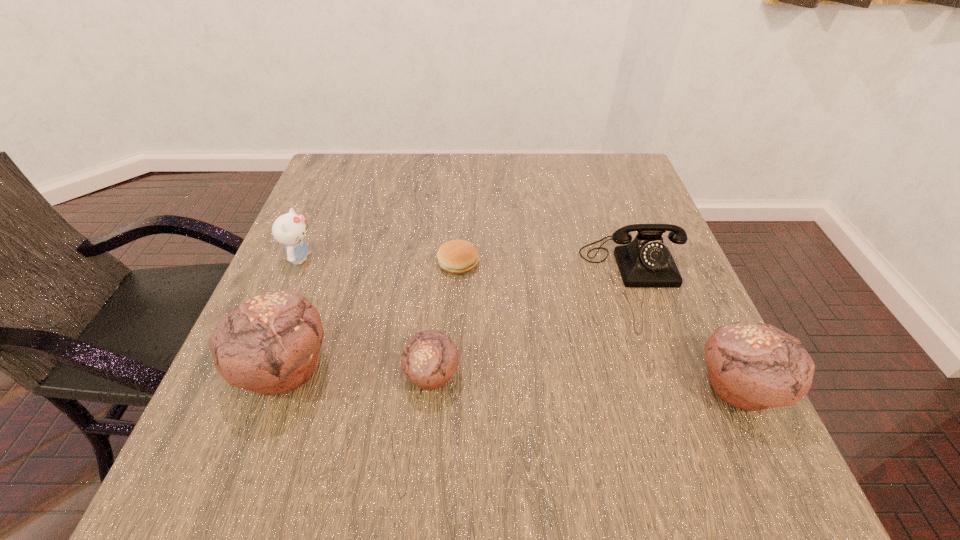
You are a GUI agent. You are given a task and a screenshot of the screen. Output one action in this format:
    pyautogui.click(x=<x>, y=<y>)
    Task: Click on the vacant space that is in between the shortest muffin and the telephone
    
    Given the screenshot: What is the action you would take?
    pyautogui.click(x=532, y=318)

Find the location of a particular element. free space between the patty and the second shortest muffin is located at coordinates (598, 326).

Image resolution: width=960 pixels, height=540 pixels. I want to click on the fifth closest object to the second shortest muffin, so click(x=289, y=229).

Identify which object is located as the nearest to the leftmost muffin. Please provide its 2D coordinates. Your answer should be formatted as a tuple, i.e. [(x, y)], where the tuple contains the x and y coordinates of a point satisfying the conditions above.

[(430, 358)]

Select which muffin appears as the closest to the shortest object. Please provide its 2D coordinates. Your answer should be formatted as a tuple, i.e. [(x, y)], where the tuple contains the x and y coordinates of a point satisfying the conditions above.

[(430, 358)]

Locate an element on the screen. the second closest muffin to the leftmost muffin is located at coordinates (751, 366).

This screenshot has height=540, width=960. In order to click on vacant space that satisfies the following two spatial constraints: 1. on the front face of the rightmost muffin; 2. on the left side of the telephone in this screenshot , I will do `click(676, 388)`.

The width and height of the screenshot is (960, 540). Identify the location of free space that satisfies the following two spatial constraints: 1. on the front-facing side of the shortest muffin; 2. on the left side of the kitten. (252, 375).

This screenshot has width=960, height=540. I want to click on free spot that satisfies the following two spatial constraints: 1. on the front face of the telephone; 2. on the left side of the rightmost muffin, so click(x=676, y=388).

Find the location of a particular element. Image resolution: width=960 pixels, height=540 pixels. vacant space that satisfies the following two spatial constraints: 1. on the front face of the telephone; 2. on the right side of the rightmost muffin is located at coordinates (676, 388).